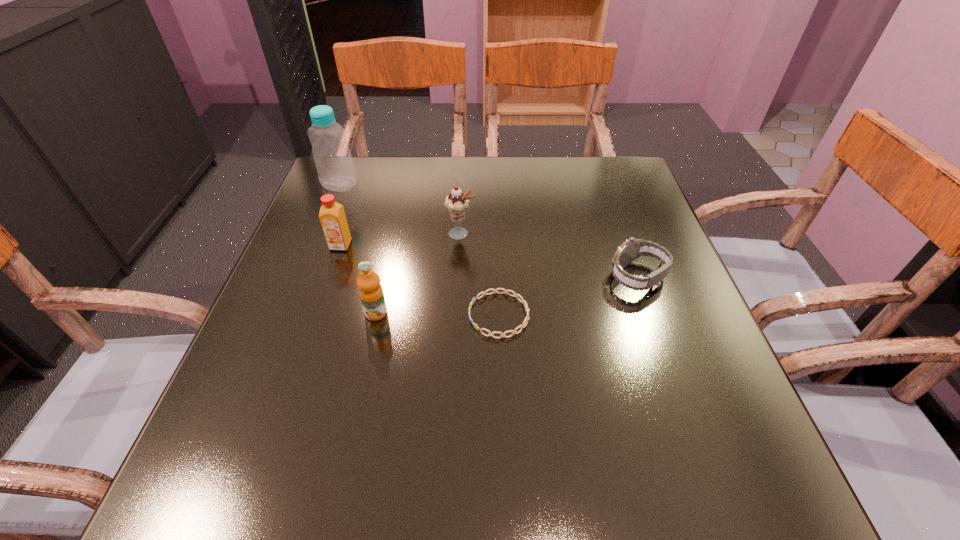
The height and width of the screenshot is (540, 960). I want to click on bottle, so click(334, 163).

Image resolution: width=960 pixels, height=540 pixels. I want to click on the farthest object, so click(334, 163).

The image size is (960, 540). In order to click on icecream in this screenshot , I will do `click(456, 202)`.

This screenshot has width=960, height=540. I want to click on the left orange juice, so click(332, 216).

You are a GUI agent. You are given a task and a screenshot of the screen. Output one action in this format:
    pyautogui.click(x=<x>, y=<y>)
    Task: Click on the nearer orange juice
    This screenshot has height=540, width=960.
    Given the screenshot: What is the action you would take?
    pyautogui.click(x=371, y=294)

The height and width of the screenshot is (540, 960). Find the location of `the third object from left to right`. the third object from left to right is located at coordinates (371, 294).

The image size is (960, 540). Identify the location of the rightmost object. (631, 249).

Where is `watch`? watch is located at coordinates (631, 249).

The image size is (960, 540). Find the location of `bracelet`. bracelet is located at coordinates (523, 301).

Find the location of `free point located on the front of the farthest object`. free point located on the front of the farthest object is located at coordinates (313, 249).